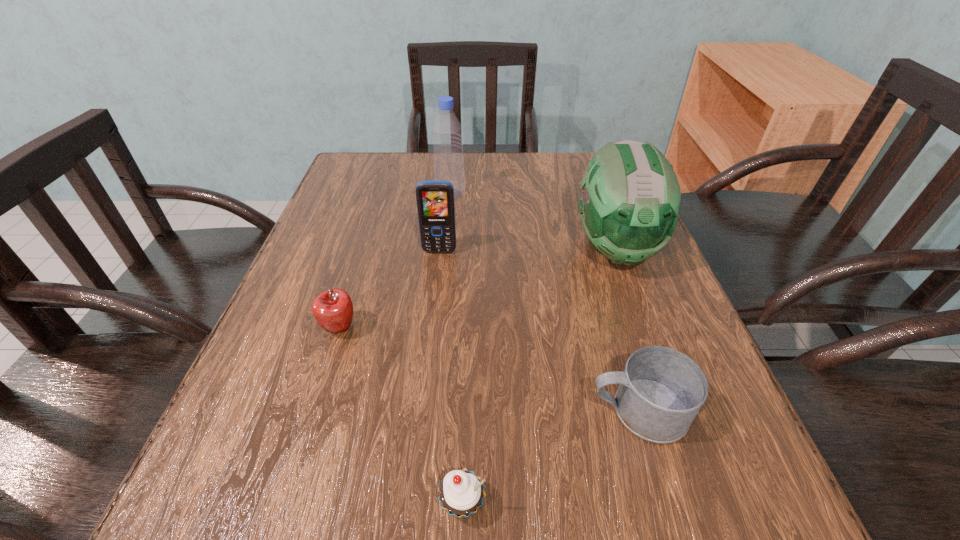
Find the location of a particular element. Image resolution: width=960 pixels, height=540 pixels. free space that is in between the cellular telephone and the second nearest object is located at coordinates (x=539, y=331).

Locate an element on the screen. vacant area that lies between the nearest object and the cellular telephone is located at coordinates point(451,378).

This screenshot has width=960, height=540. Identify the location of free spot between the cellular telephone and the nearest object. (451, 378).

What are the coordinates of `vacant point located between the mug and the farthest object` in the screenshot? It's located at (544, 302).

Where is `the second closest object to the football helmet`? This screenshot has height=540, width=960. the second closest object to the football helmet is located at coordinates (447, 132).

Locate which object is the closest to the third nearest object. Please provide its 2D coordinates. Your answer should be formatted as a tuple, i.e. [(x, y)], where the tuple contains the x and y coordinates of a point satisfying the conditions above.

[(435, 201)]

Identify the location of free location that satisfies the following two spatial constraints: 1. on the front side of the cupcake; 2. on the left side of the bottle. (421, 504).

Locate an element on the screen. This screenshot has height=540, width=960. vacant space that satisfies the following two spatial constraints: 1. on the side of the fifth farthest object with the handle; 2. on the front side of the cupcake is located at coordinates (666, 504).

At what (x,y) coordinates should I click in order to perform the action: click on free space that satisfies the following two spatial constraints: 1. on the front side of the cupcake; 2. on the right side of the bottle. Please return your answer as a coordinate pair (x, y). Looking at the image, I should click on (421, 504).